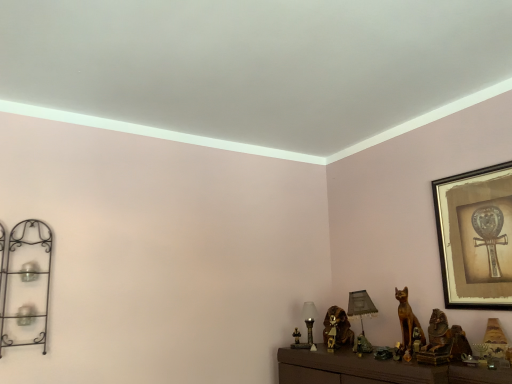
Question: Is black wrought iron shelf at left wider or thinner than matte glass table lamp at center, the 2th table lamp in the right-to-left sequence?

Choices:
 (A) thin
 (B) wide

Answer: (A)

Question: Is point (38, 276) positioned closer to the camera than point (314, 309)?

Choices:
 (A) closer
 (B) farther

Answer: (A)

Question: Which is nearer to the black wrought iron shelf at left?

Choices:
 (A) brown metallic cat at center, the 2th animal from the front
 (B) golden wood cat at lower right, the 1th animal from the front
 (C) matte gray lampshade at center, the first table lamp when ordered from right to left
 (D) gold-framed artwork at upper right
 (E) matte glass table lamp at center, the 1th table lamp from the left

Answer: (E)

Question: Which is farther from the gold-framed artwork at upper right?

Choices:
 (A) black wrought iron shelf at left
 (B) golden wood cat at lower right, arranged as the second animal when viewed from the back
 (C) matte glass table lamp at center, the 1th table lamp from the left
 (D) brown metallic cat at center, which is the 2th animal from right to left
 (E) matte gray lampshade at center, the first table lamp when ordered from right to left

Answer: (A)